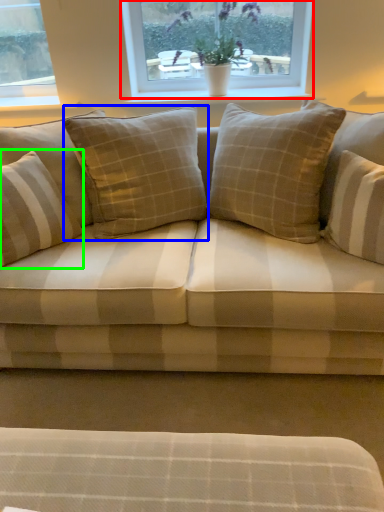
Question: Which object is the farthest from window (highlighted by a red box)? Choose among these: pillow (highlighted by a blue box) or pillow (highlighted by a green box).

Choices:
 (A) pillow
 (B) pillow

Answer: (B)